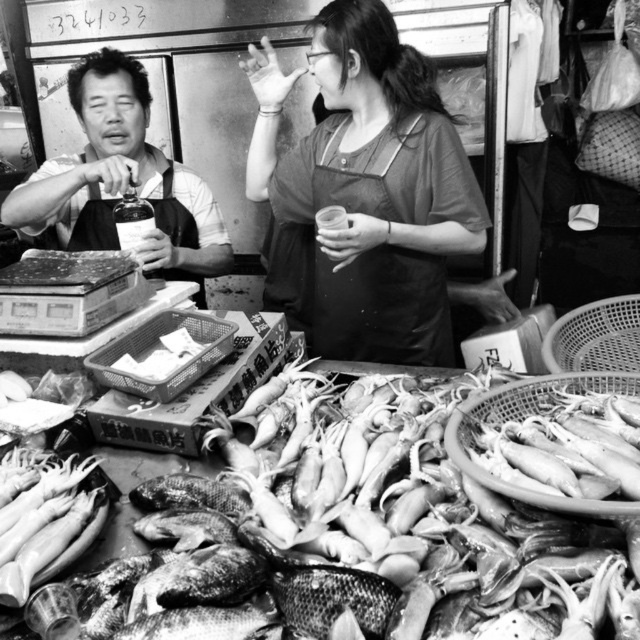
Question: Is matte apron at center positioned before smooth apron at left?

Choices:
 (A) no
 (B) yes

Answer: (B)

Question: Considering the relative positions of matte apron at center and black fabric apron at center in the image provided, where is matte apron at center located with respect to black fabric apron at center?

Choices:
 (A) left
 (B) right

Answer: (B)

Question: Which point is farther from the camera taking this photo?

Choices:
 (A) (392, 355)
 (B) (320, 166)
 (C) (225, 228)

Answer: (C)

Question: Which point appears closest to the camera in this image?

Choices:
 (A) (83, 97)
 (B) (314, 340)

Answer: (A)

Question: From the image, what is the correct spatial relationship of matte apron at center in relation to smooth apron at left?

Choices:
 (A) right
 (B) left

Answer: (A)

Question: Among these points, which one is nearest to the camera?

Choices:
 (A) (388, 336)
 (B) (138, 83)
 (C) (403, 205)

Answer: (C)